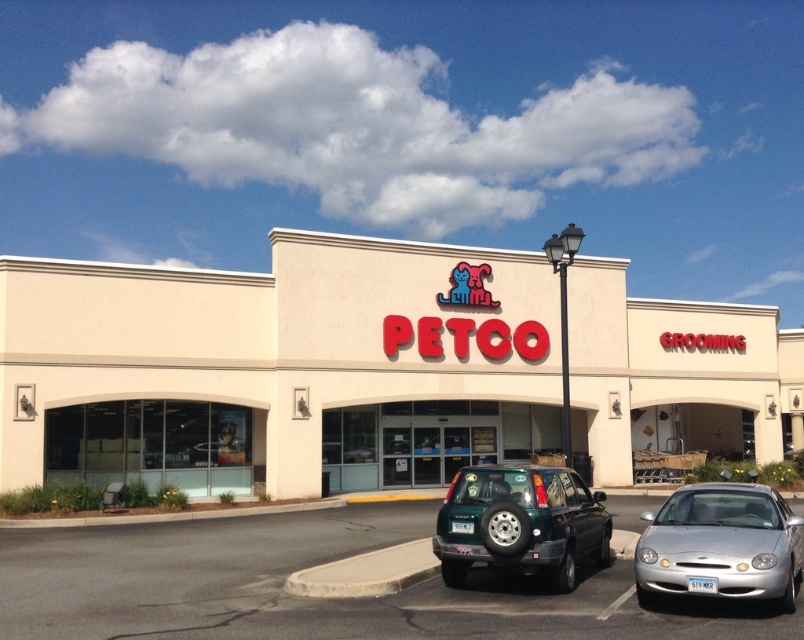
You are a delivery driver who needs to park your truck, which is 18 feet long, in the Petco parking lot. You see the silver metallic car at lower right and the green matte car at center. Which car is too big to fit in a standard parking spot that is 16 feet long?

The silver metallic car at lower right is larger in size than the green matte car at center, so the silver metallic car at lower right is too big to fit in a standard parking spot that is 16 feet long.